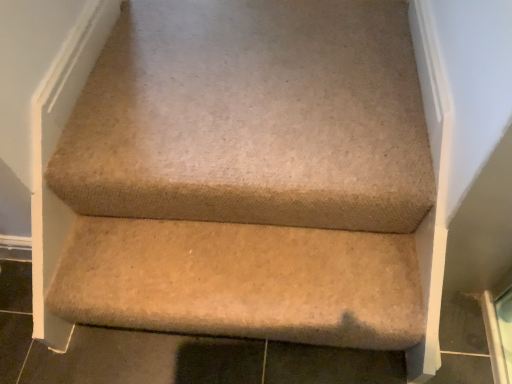
Question: Is beige carpeted stairs at center surrounded by beige carpeted stair at lower center?

Choices:
 (A) yes
 (B) no

Answer: (B)

Question: Is beige carpeted stair at lower center aimed at beige carpeted stairs at center?

Choices:
 (A) no
 (B) yes

Answer: (A)

Question: Considering the relative positions of beige carpeted stair at lower center and beige carpeted stairs at center in the image provided, is beige carpeted stair at lower center to the right of beige carpeted stairs at center from the viewer's perspective?

Choices:
 (A) no
 (B) yes

Answer: (A)

Question: Are beige carpeted stair at lower center and beige carpeted stairs at center located far from each other?

Choices:
 (A) yes
 (B) no

Answer: (B)

Question: Considering the relative positions of beige carpeted stair at lower center and beige carpeted stairs at center in the image provided, is beige carpeted stair at lower center to the left of beige carpeted stairs at center from the viewer's perspective?

Choices:
 (A) yes
 (B) no

Answer: (A)

Question: Can you confirm if beige carpeted stair at lower center is bigger than beige carpeted stairs at center?

Choices:
 (A) yes
 (B) no

Answer: (A)

Question: From a real-world perspective, is beige carpeted stairs at center located higher than beige carpeted stair at lower center?

Choices:
 (A) no
 (B) yes

Answer: (B)

Question: Is beige carpeted stairs at center wider than beige carpeted stair at lower center?

Choices:
 (A) no
 (B) yes

Answer: (B)

Question: Can beige carpeted stair at lower center be found inside beige carpeted stairs at center?

Choices:
 (A) yes
 (B) no

Answer: (B)

Question: Considering the relative sizes of beige carpeted stairs at center and beige carpeted stair at lower center in the image provided, is beige carpeted stairs at center thinner than beige carpeted stair at lower center?

Choices:
 (A) no
 (B) yes

Answer: (A)

Question: Can you confirm if beige carpeted stairs at center is smaller than beige carpeted stair at lower center?

Choices:
 (A) no
 (B) yes

Answer: (B)

Question: Does beige carpeted stairs at center touch beige carpeted stair at lower center?

Choices:
 (A) yes
 (B) no

Answer: (B)

Question: Is beige carpeted stair at lower center to the left or to the right of beige carpeted stairs at center in the image?

Choices:
 (A) right
 (B) left

Answer: (B)